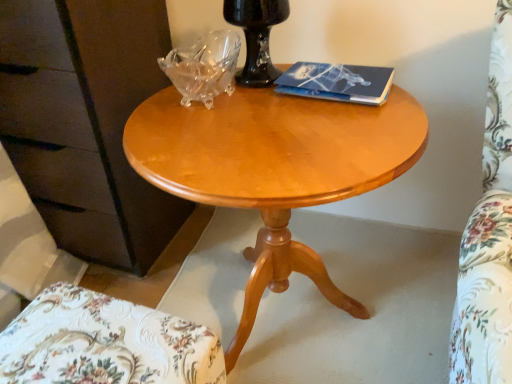
Question: Is white floral fabric chair at lower left smaller than matte brown dresser at left?

Choices:
 (A) yes
 (B) no

Answer: (A)

Question: From a real-world perspective, is white floral fabric chair at lower left positioned over matte brown dresser at left based on gravity?

Choices:
 (A) no
 (B) yes

Answer: (A)

Question: Is there a large distance between white floral fabric chair at lower left and matte brown dresser at left?

Choices:
 (A) no
 (B) yes

Answer: (A)

Question: Is white floral fabric chair at lower left touching matte brown dresser at left?

Choices:
 (A) yes
 (B) no

Answer: (B)

Question: Could you tell me if white floral fabric chair at lower left is facing matte brown dresser at left?

Choices:
 (A) yes
 (B) no

Answer: (B)

Question: Is white floral fabric chair at lower left looking in the opposite direction of matte brown dresser at left?

Choices:
 (A) yes
 (B) no

Answer: (B)

Question: Is light wood/finish coffee table at center smaller than matte brown dresser at left?

Choices:
 (A) no
 (B) yes

Answer: (B)

Question: Can you confirm if light wood/finish coffee table at center is positioned to the right of matte brown dresser at left?

Choices:
 (A) yes
 (B) no

Answer: (A)

Question: Can you confirm if light wood/finish coffee table at center is thinner than matte brown dresser at left?

Choices:
 (A) no
 (B) yes

Answer: (A)

Question: Is light wood/finish coffee table at center next to matte brown dresser at left and touching it?

Choices:
 (A) yes
 (B) no

Answer: (B)

Question: Is light wood/finish coffee table at center facing away from matte brown dresser at left?

Choices:
 (A) no
 (B) yes

Answer: (A)

Question: Is light wood/finish coffee table at center to the left of matte brown dresser at left from the viewer's perspective?

Choices:
 (A) no
 (B) yes

Answer: (A)

Question: Is light wood/finish coffee table at center positioned beyond the bounds of blue matte paper at upper right?

Choices:
 (A) no
 (B) yes

Answer: (B)